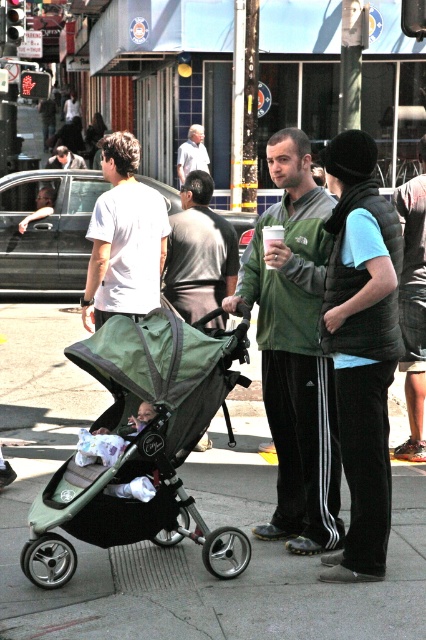
You are a photographer standing behind the two individuals on the sidewalk. You want to take a photo of the light gray shirt at center without the dark gray vest at center blocking it. Is this possible based on their current positions?

The dark gray vest at center is positioned under the light gray shirt at center, so the light gray shirt at center is above the dark gray vest at center. Therefore, the photographer can take a photo of the light gray shirt at center without obstruction from the dark gray vest at center as it is below it.

You are a delivery person trying to navigate through the sidewalk between the two people. The green matte jacket at center and the white paper cup at center are in your way. Which object should you move to create more space for your delivery cart?

The green matte jacket at center is wider than the white paper cup at center, so moving the green matte jacket at center would create more space for the delivery cart.